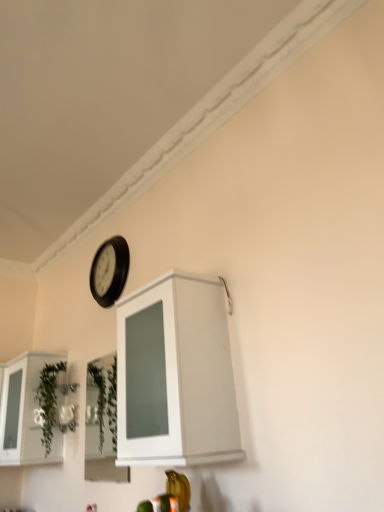
Question: In terms of height, does green leafy plant at lower left look taller or shorter compared to black plastic clock at upper center?

Choices:
 (A) tall
 (B) short

Answer: (A)

Question: In the image, is green leafy plant at lower left positioned in front of or behind black plastic clock at upper center?

Choices:
 (A) behind
 (B) front

Answer: (A)

Question: Estimate the real-world distances between objects in this image. Which object is closer to the white glossy cabinet at left, the 2th cabinetry viewed from the right?

Choices:
 (A) green leafy plant at lower left
 (B) white glossy cabinet at upper center, which is counted as the 1th cabinetry, starting from the right
 (C) black plastic clock at upper center

Answer: (A)

Question: Estimate the real-world distances between objects in this image. Which object is closer to the black plastic clock at upper center?

Choices:
 (A) white glossy cabinet at upper center, which is counted as the 1th cabinetry, starting from the right
 (B) green leafy plant at lower left
 (C) white glossy cabinet at left, which is counted as the 1th cabinetry, starting from the left

Answer: (B)